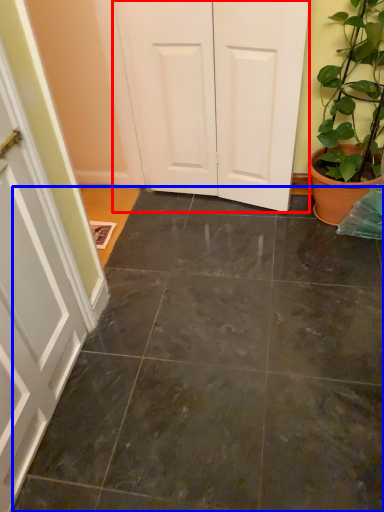
Question: Which object appears closest to the camera in this image, door (highlighted by a red box) or concrete (highlighted by a blue box)?

Choices:
 (A) door
 (B) concrete

Answer: (B)